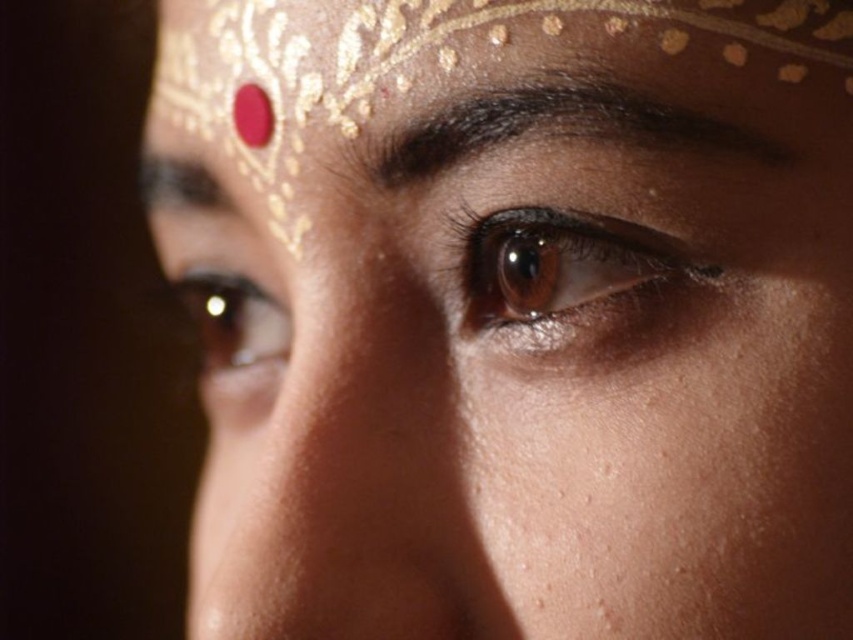
You are an artist sketching the portrait and need to place the dark brown hair at upper center and the brown matte eye at center. According to the image, which object is positioned to the right side of the other?

The brown matte eye at center is to the right of dark brown hair at upper center.

In the scene shown: You are an artist sketching the portrait and need to determine the vertical positioning of the dark brown hair at upper center and the brown shiny eye at center. Which object is positioned lower in the image?

The dark brown hair at upper center has a lesser height compared to the brown shiny eye at center, meaning the dark brown hair at upper center is positioned lower in the image.